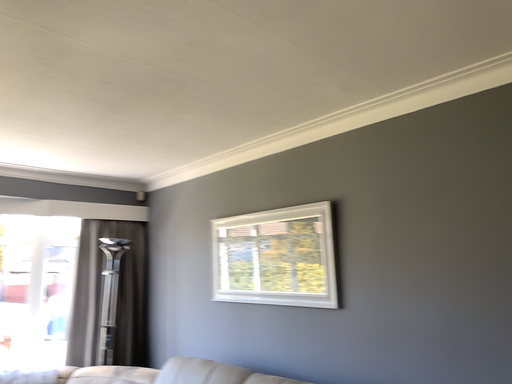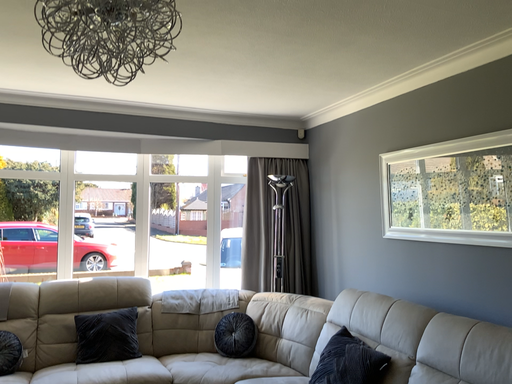
Question: How did the camera likely rotate when shooting the video?

Choices:
 (A) rotated downward
 (B) rotated upward

Answer: (A)